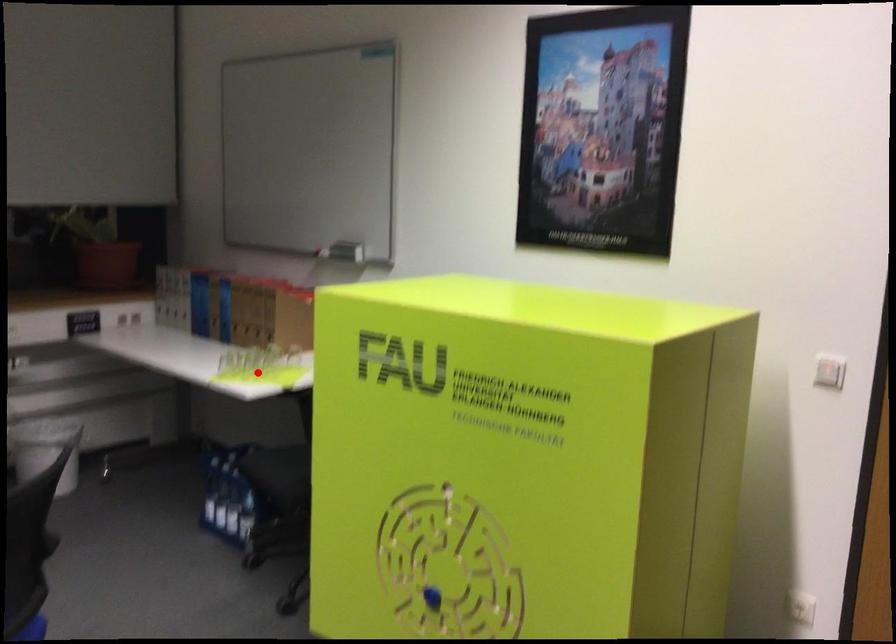
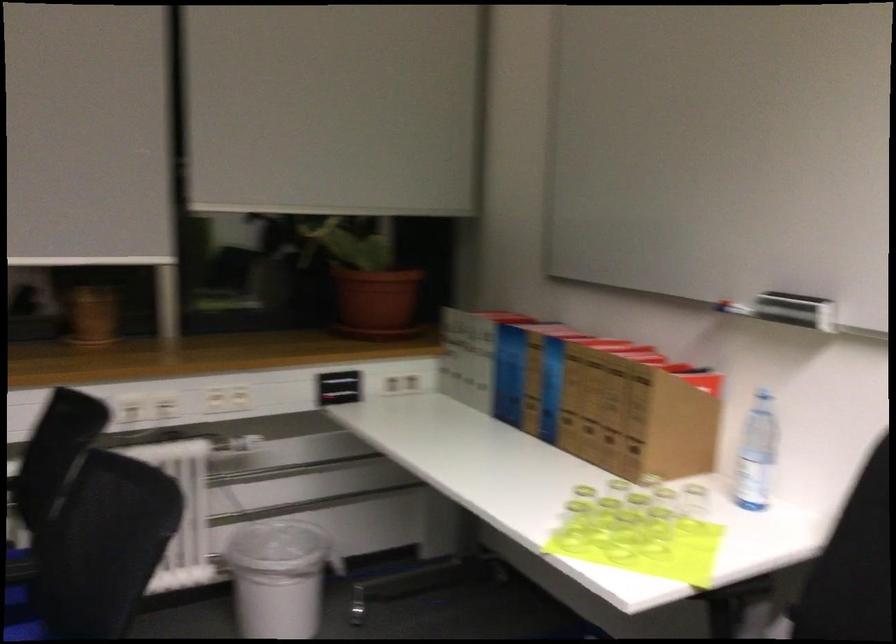
Question: I am providing you with two images of the same scene from different viewpoints. A red point is marked on the first image. At the location where the point appears in image 1, is it still visible in image 2?

Choices:
 (A) Yes
 (B) No

Answer: (A)